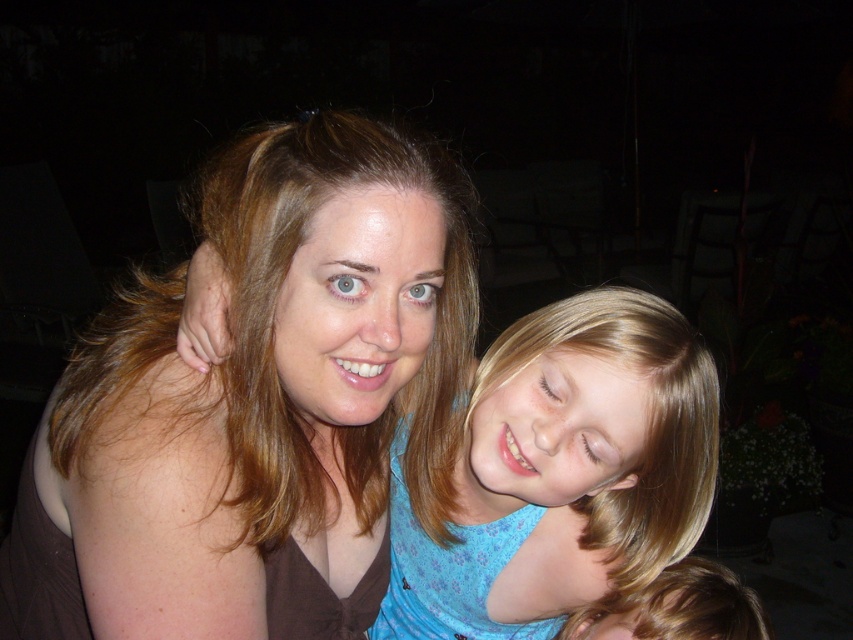
You are standing at point (550,564) and want to walk towards the direction of point (379,128). Which direction should you move in?

You should move forward because point (379,128) is in front of point (550,564).

You are a photographer who just took a photo of two people wearing the matte brown shirt at center and the blue floral shirt at center. Based on the scene, which shirt is positioned higher in the image?

The matte brown shirt at center is located above the blue floral shirt at center, so the matte brown shirt at center is positioned higher.

You are a photographer setting up for a group photo. You need to ensure that the two subjects wearing the matte brown shirt at center and the blue floral shirt at center are at least 20 centimeters apart for proper framing. Based on the current image, will you need to adjust their positions?

The distance between the matte brown shirt at center and the blue floral shirt at center is 15.30 centimeters, which is less than the required 20 centimeters. Therefore, you will need to adjust their positions to increase the distance between them.